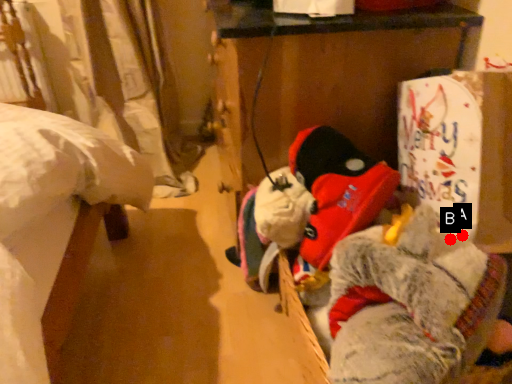
Question: Two points are circled on the image, labeled by A and B beside each circle. Which point is farther from the camera taking this photo?

Choices:
 (A) A is further
 (B) B is further

Answer: (A)